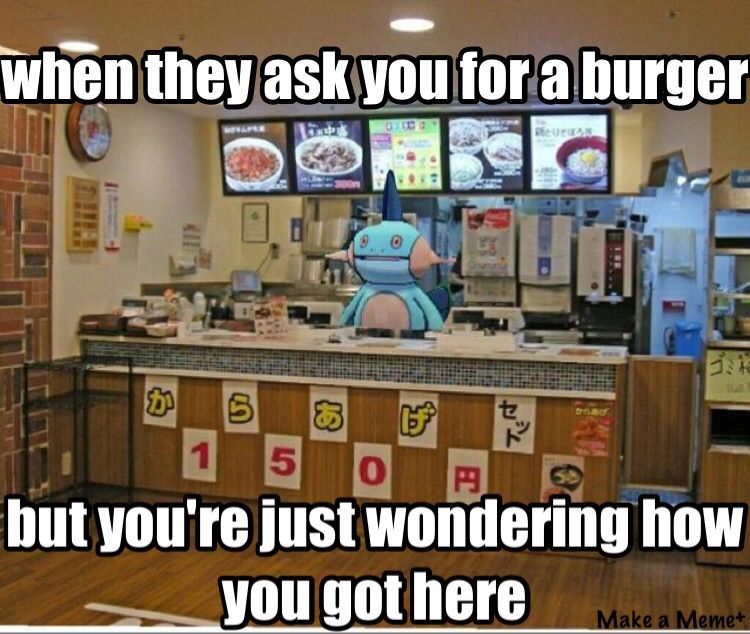
Where is `shelves`? Image resolution: width=750 pixels, height=634 pixels. shelves is located at coordinates (76, 401), (73, 368).